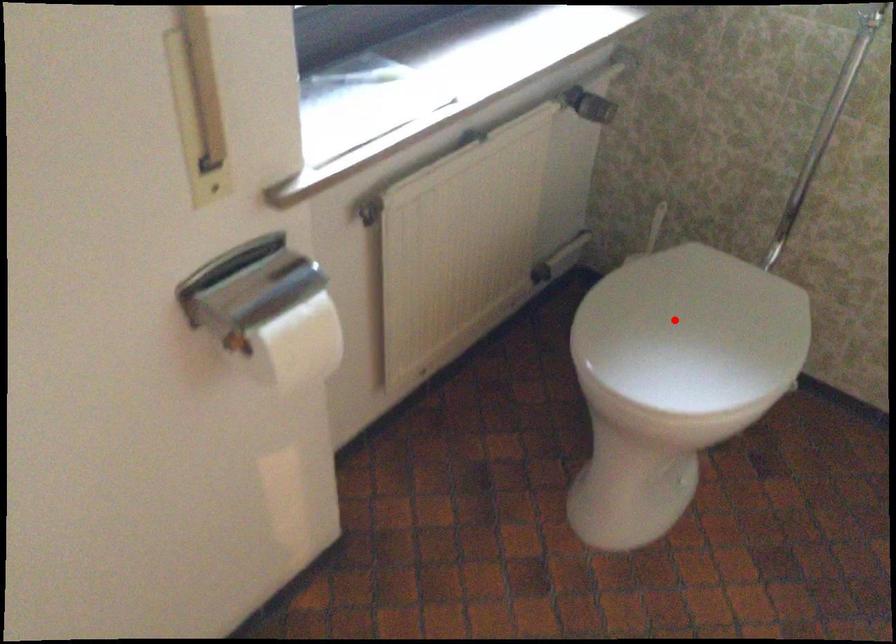
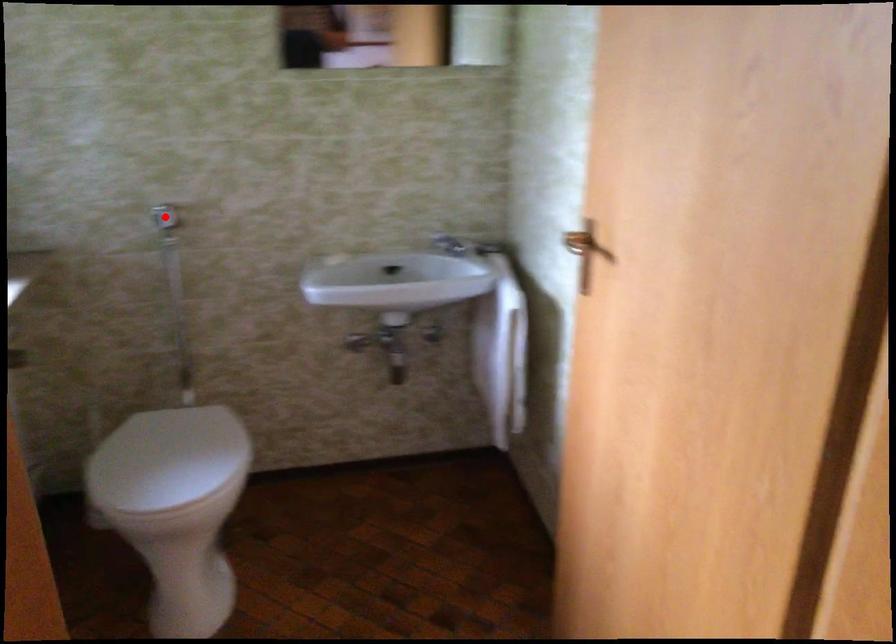
I am providing you with two images of the same scene from different viewpoints. A red point is marked on the first image and another point is marked on the second image. Are the points marked in image1 and image2 representing the same 3D position?

No